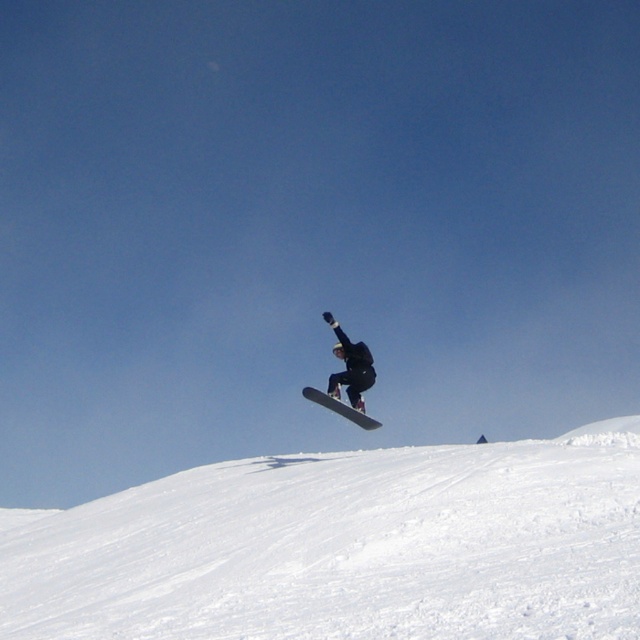
Who is positioned more to the left, white powdery snow at lower left or black matte snowboarder at center?

white powdery snow at lower left

Where is `white powdery snow at lower left`? white powdery snow at lower left is located at coordinates (346, 547).

Based on the photo, measure the distance between black matte snowboarder at center and camera.

A distance of 24.33 meters exists between black matte snowboarder at center and camera.

Which is below, black matte snowboarder at center or white matte snowboard at center?

white matte snowboard at center

The image size is (640, 640). I want to click on black matte snowboarder at center, so click(348, 378).

Locate an element on the screen. This screenshot has width=640, height=640. black matte snowboarder at center is located at coordinates [348, 378].

Can you confirm if white powdery snow at lower left is positioned above white matte snowboard at center?

No.

Who is more distant from viewer, (220, 582) or (328, 397)?

The point (328, 397) is more distant.

The image size is (640, 640). Identify the location of white powdery snow at lower left. (346, 547).